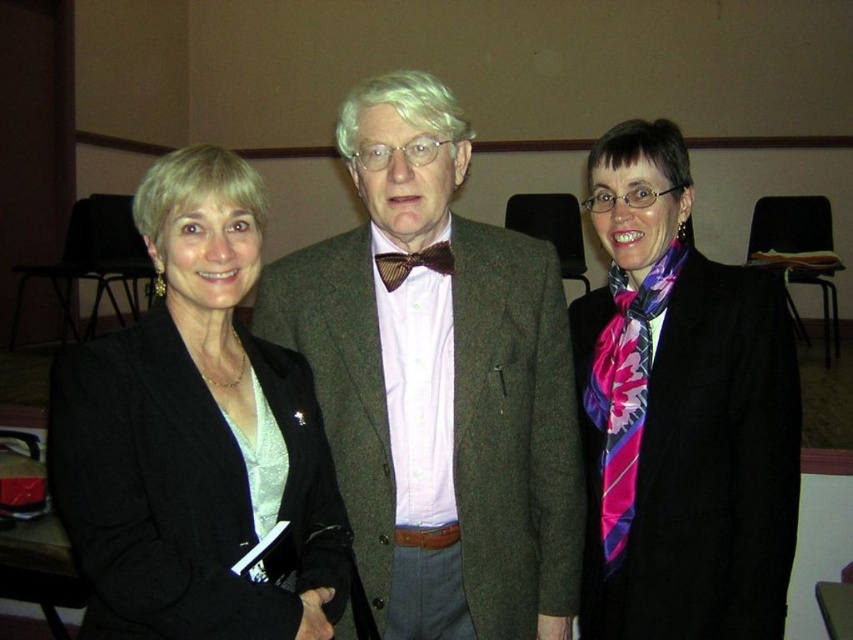
Between point (515, 256) and point (436, 260), which one is positioned in front?

Point (436, 260)

Does brown woolen suit at center appear over brown textured bow tie at center?

No.

Between point (405, 97) and point (398, 280), which one is positioned in front?

Point (405, 97) is in front.

Where is `brown woolen suit at center`? The height and width of the screenshot is (640, 853). brown woolen suit at center is located at coordinates (439, 385).

Which is below, brown woolen suit at center or pink silk scarf at center?

Positioned lower is brown woolen suit at center.

Is point (437, 560) closer to camera compared to point (627, 344)?

Yes.

Locate an element on the screen. This screenshot has height=640, width=853. brown woolen suit at center is located at coordinates (439, 385).

Is brown woolen suit at center thinner than black fabric jacket at left?

Incorrect, brown woolen suit at center's width is not less than black fabric jacket at left's.

Does brown woolen suit at center appear over black fabric jacket at left?

Yes.

The height and width of the screenshot is (640, 853). What are the coordinates of `brown woolen suit at center` in the screenshot? It's located at (439, 385).